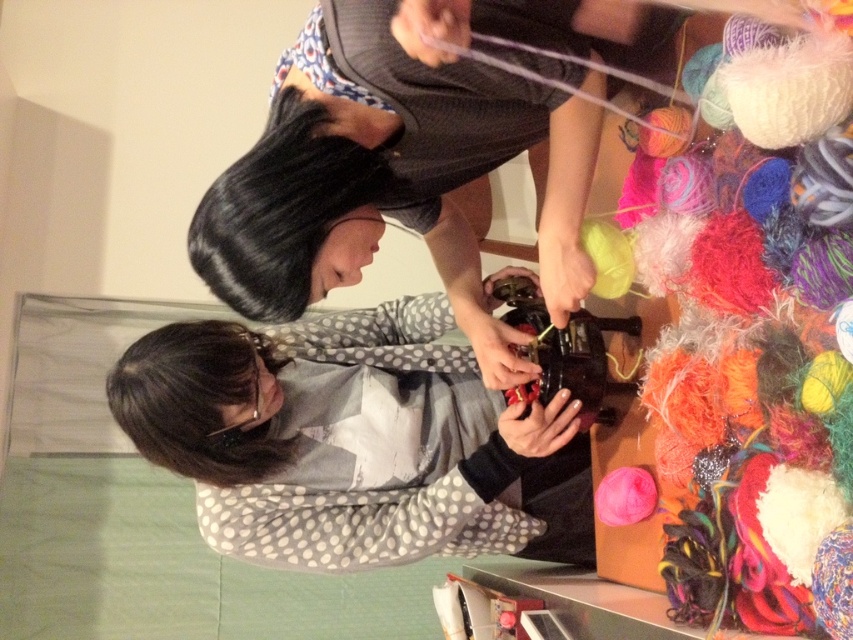
Question: Can you confirm if polka dot fabric shirt at center is positioned to the left of dark brown hair at lower left?

Choices:
 (A) no
 (B) yes

Answer: (A)

Question: Based on their relative distances, which object is farther from the matte gray sweater at center?

Choices:
 (A) dark brown hair at lower left
 (B) black silky hair at upper center

Answer: (A)

Question: Is matte gray sweater at center smaller than polka dot fabric shirt at center?

Choices:
 (A) no
 (B) yes

Answer: (B)

Question: Among these objects, which one is nearest to the camera?

Choices:
 (A) dark brown hair at lower left
 (B) polka dot fabric shirt at center

Answer: (A)

Question: Among these objects, which one is farthest from the camera?

Choices:
 (A) black silky hair at upper center
 (B) polka dot fabric shirt at center

Answer: (B)

Question: Does matte gray sweater at center appear under dark brown hair at lower left?

Choices:
 (A) yes
 (B) no

Answer: (B)